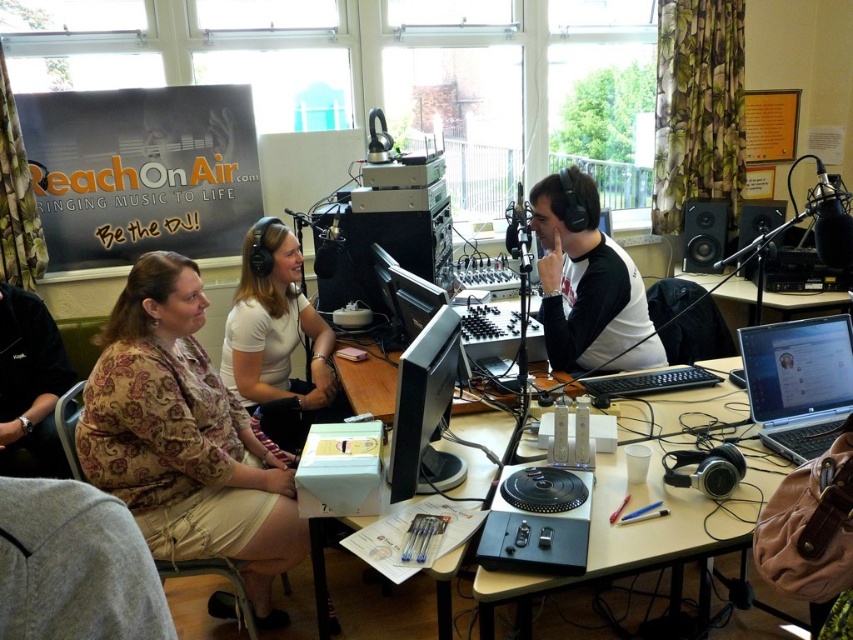
Question: Which object appears farthest from the camera in this image?

Choices:
 (A) matte black headphones at center
 (B) silver metallic laptop at center

Answer: (A)

Question: Can you confirm if white matte shirt at center is positioned above black matte speaker at center right?

Choices:
 (A) yes
 (B) no

Answer: (B)

Question: Which point appears farthest from the camera in this image?

Choices:
 (A) (776, 202)
 (B) (698, 282)

Answer: (A)

Question: Does matte black headphones at center have a smaller size compared to white matte shirt at center?

Choices:
 (A) yes
 (B) no

Answer: (A)

Question: Where is paisley-patterned blouse at left located in relation to white matte shirt at center in the image?

Choices:
 (A) right
 (B) left

Answer: (B)

Question: Which of the following is the closest to the observer?

Choices:
 (A) (286, 467)
 (B) (271, 380)
 (C) (747, 264)

Answer: (A)